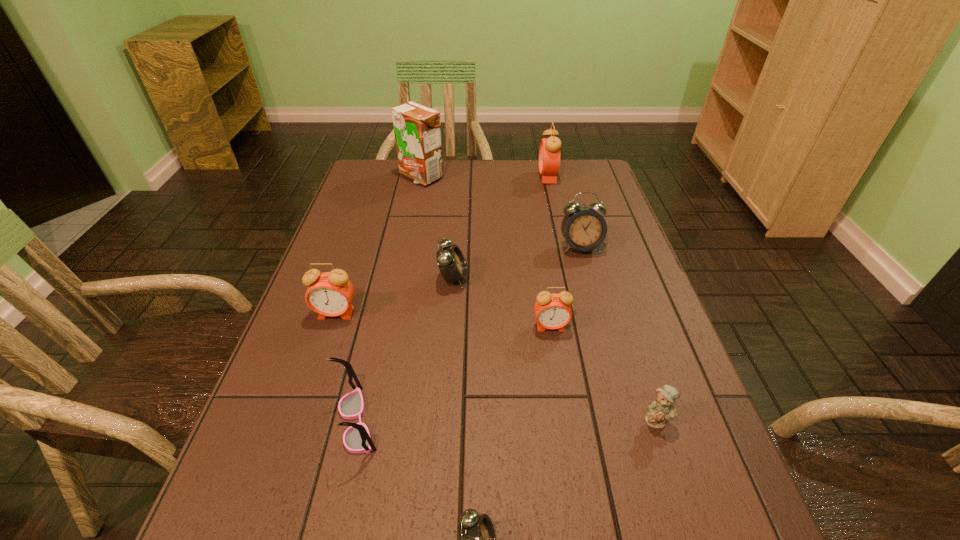
Find the location of a particular element. free area in between the fifth nearest alarm clock and the spectacles is located at coordinates (468, 334).

Where is `free space between the fourth nearest alarm clock and the second smallest pink alarm clock`? free space between the fourth nearest alarm clock and the second smallest pink alarm clock is located at coordinates (395, 296).

Where is `object that is the nearest to the nearest alarm clock`? object that is the nearest to the nearest alarm clock is located at coordinates [357, 439].

Identify which object is located as the third nearest to the tallest object. Please provide its 2D coordinates. Your answer should be formatted as a tuple, i.e. [(x, y)], where the tuple contains the x and y coordinates of a point satisfying the conditions above.

[(584, 229)]

Where is `alarm clock identified as the closest to the eighth shortest object`? Image resolution: width=960 pixels, height=540 pixels. alarm clock identified as the closest to the eighth shortest object is located at coordinates (584, 229).

Select which alarm clock is the fifth closest to the sixth nearest object. Please provide its 2D coordinates. Your answer should be formatted as a tuple, i.e. [(x, y)], where the tuple contains the x and y coordinates of a point satisfying the conditions above.

[(476, 537)]

At what (x,y) coordinates should I click in order to perform the action: click on pink alarm clock that is the second closest to the second biggest white alarm clock. Please return your answer as a coordinate pair (x, y). This screenshot has width=960, height=540. Looking at the image, I should click on (330, 294).

Locate which pink alarm clock is the third closest to the spectacles. Please provide its 2D coordinates. Your answer should be formatted as a tuple, i.e. [(x, y)], where the tuple contains the x and y coordinates of a point satisfying the conditions above.

[(549, 153)]

This screenshot has height=540, width=960. I want to click on white alarm clock that is the second nearest to the spectacles, so click(451, 262).

Select which white alarm clock appears as the second closest to the sixth object from left to right. Please provide its 2D coordinates. Your answer should be formatted as a tuple, i.e. [(x, y)], where the tuple contains the x and y coordinates of a point satisfying the conditions above.

[(584, 229)]